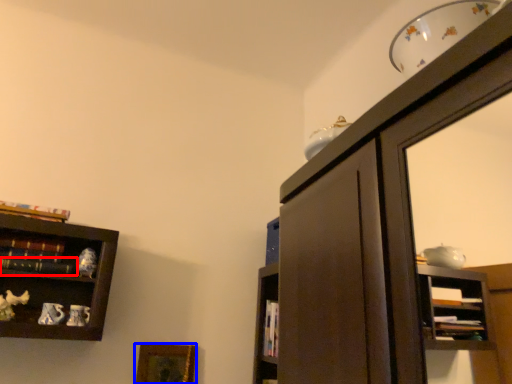
Question: Which point is further to the camera, book (highlighted by a red box) or picture frame (highlighted by a blue box)?

Choices:
 (A) book
 (B) picture frame

Answer: (B)